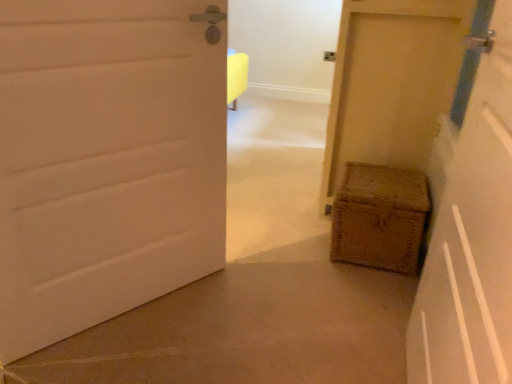
Question: Should I look upward or downward to see woven wood chest at lower right, acting as the third door starting from the left?

Choices:
 (A) up
 (B) down

Answer: (A)

Question: Considering the relative positions of woven wood chest at lower right, which ranks as the 1th door in right-to-left order, and matte yellow door at right, which is the second door from right to left, in the image provided, is woven wood chest at lower right, which ranks as the 1th door in right-to-left order, behind matte yellow door at right, which is the second door from right to left,?

Choices:
 (A) no
 (B) yes

Answer: (B)

Question: From the image's perspective, is woven wood chest at lower right, which ranks as the 1th door in right-to-left order, above matte yellow door at right, which is the second door from right to left?

Choices:
 (A) no
 (B) yes

Answer: (B)

Question: Is woven wood chest at lower right, which ranks as the 1th door in right-to-left order, positioned in front of matte yellow door at right, arranged as the 2th door when viewed from the left?

Choices:
 (A) no
 (B) yes

Answer: (A)

Question: Can you confirm if woven wood chest at lower right, which ranks as the 1th door in right-to-left order, is positioned to the right of matte yellow door at right, arranged as the 2th door when viewed from the left?

Choices:
 (A) yes
 (B) no

Answer: (A)

Question: Does woven wood chest at lower right, which ranks as the 1th door in right-to-left order, have a greater width compared to matte yellow door at right, which is the second door from right to left?

Choices:
 (A) no
 (B) yes

Answer: (B)

Question: Can you confirm if woven wood chest at lower right, which ranks as the 1th door in right-to-left order, is taller than matte yellow door at right, arranged as the 2th door when viewed from the left?

Choices:
 (A) no
 (B) yes

Answer: (B)

Question: Is woven brown basket at lower right closer to the viewer compared to woven wood chest at lower right, acting as the third door starting from the left?

Choices:
 (A) yes
 (B) no

Answer: (B)

Question: Is woven brown basket at lower right far away from woven wood chest at lower right, acting as the third door starting from the left?

Choices:
 (A) no
 (B) yes

Answer: (A)

Question: Is woven wood chest at lower right, which ranks as the 1th door in right-to-left order, surrounded by woven brown basket at lower right?

Choices:
 (A) yes
 (B) no

Answer: (B)

Question: Is woven brown basket at lower right outside of woven wood chest at lower right, which ranks as the 1th door in right-to-left order?

Choices:
 (A) yes
 (B) no

Answer: (A)

Question: Considering the relative positions of woven brown basket at lower right and woven wood chest at lower right, acting as the third door starting from the left, in the image provided, is woven brown basket at lower right to the left of woven wood chest at lower right, acting as the third door starting from the left, from the viewer's perspective?

Choices:
 (A) yes
 (B) no

Answer: (A)

Question: Can you confirm if woven brown basket at lower right is bigger than woven wood chest at lower right, which ranks as the 1th door in right-to-left order?

Choices:
 (A) no
 (B) yes

Answer: (A)

Question: Is woven wood chest at lower right, which ranks as the 1th door in right-to-left order, facing away from white matte door at left, which is the 3th door from right to left?

Choices:
 (A) no
 (B) yes

Answer: (A)